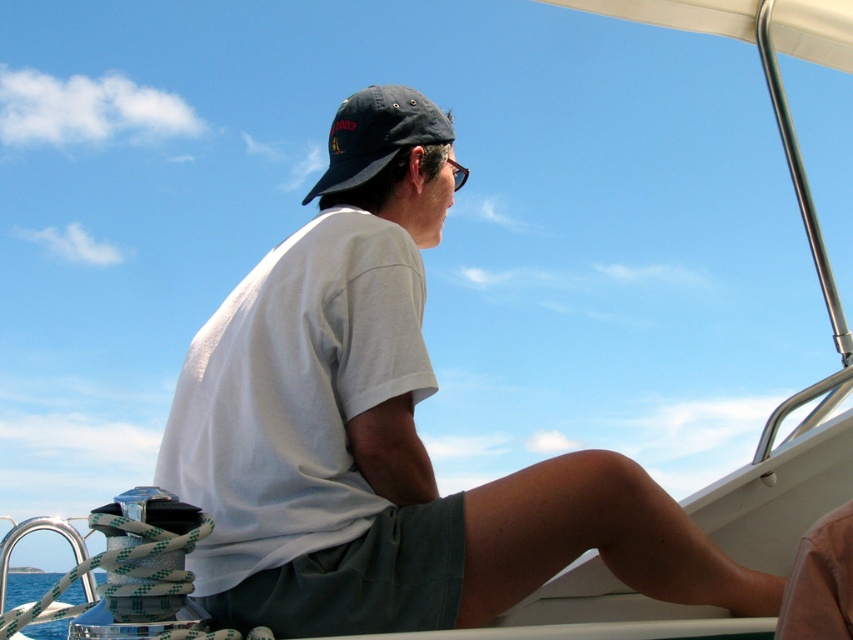
Question: Can you confirm if dark gray cotton shorts at lower center is thinner than transparent plastic goggles at upper center?

Choices:
 (A) no
 (B) yes

Answer: (A)

Question: Which is nearer to the dark blue fabric baseball cap at upper center?

Choices:
 (A) dark gray cotton shorts at lower center
 (B) white cotton shirt at center
 (C) transparent plastic goggles at upper center
 (D) blue water at lower left

Answer: (C)

Question: Which object is positioned farthest from the transparent plastic goggles at upper center?

Choices:
 (A) dark gray cotton shorts at lower center
 (B) dark blue fabric baseball cap at upper center
 (C) white cotton shirt at center
 (D) blue water at lower left

Answer: (D)

Question: Which of the following is the farthest from the observer?

Choices:
 (A) click(337, 173)
 (B) click(461, 184)
 (C) click(341, 116)
 (D) click(57, 580)

Answer: (B)

Question: Can you confirm if white cotton shirt at center is positioned to the left of dark gray cotton shorts at lower center?

Choices:
 (A) yes
 (B) no

Answer: (B)

Question: Can you confirm if dark blue fabric baseball cap at upper center is smaller than blue water at lower left?

Choices:
 (A) yes
 (B) no

Answer: (A)